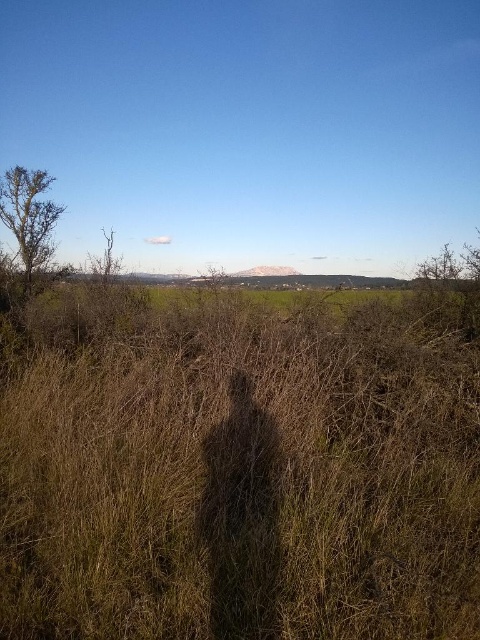
Does brown dry grass at center appear on the right side of bare branches at left?

Yes, brown dry grass at center is to the right of bare branches at left.

What do you see at coordinates (240, 468) in the screenshot? I see `brown dry grass at center` at bounding box center [240, 468].

What are the coordinates of `brown dry grass at center` in the screenshot? It's located at (240, 468).